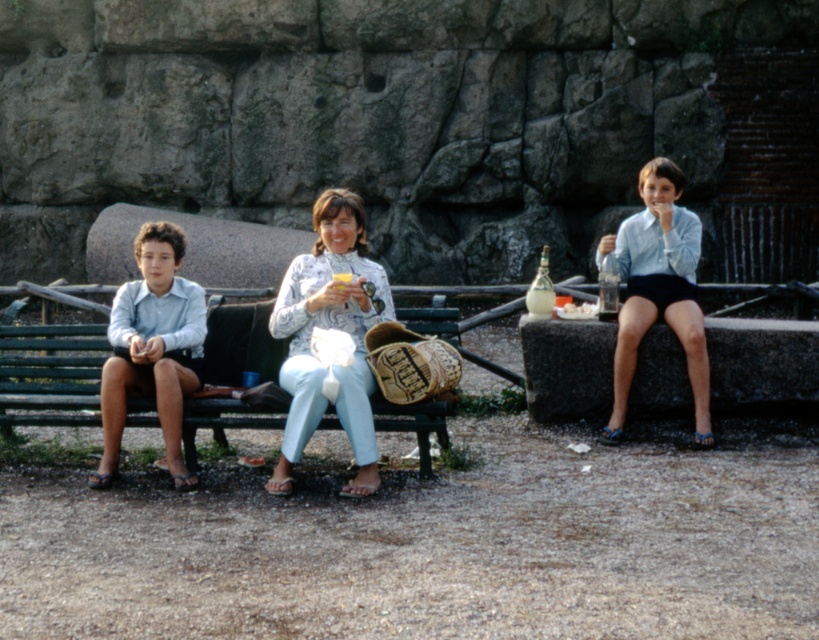
Question: Which of the following is the closest to the observer?

Choices:
 (A) white paper napkin at center
 (B) patterned fabric blouse at center
 (C) green painted wood bench at center

Answer: (B)

Question: Is patterned fabric blouse at center bigger than matte blue shirt at left?

Choices:
 (A) no
 (B) yes

Answer: (B)

Question: Can you confirm if light blue denim jeans at center is thinner than green painted wood bench at center?

Choices:
 (A) no
 (B) yes

Answer: (B)

Question: Which point appears farthest from the camera in this image?

Choices:
 (A) (356, 419)
 (B) (664, 211)
 (C) (346, 380)

Answer: (B)

Question: From the image, what is the correct spatial relationship of patterned fabric blouse at center in relation to light blue shirt at center?

Choices:
 (A) above
 (B) below

Answer: (B)

Question: Based on their relative distances, which object is farther from the matte blue shirt at left?

Choices:
 (A) white paper napkin at center
 (B) green painted wood bench at center
 (C) patterned fabric blouse at center

Answer: (A)